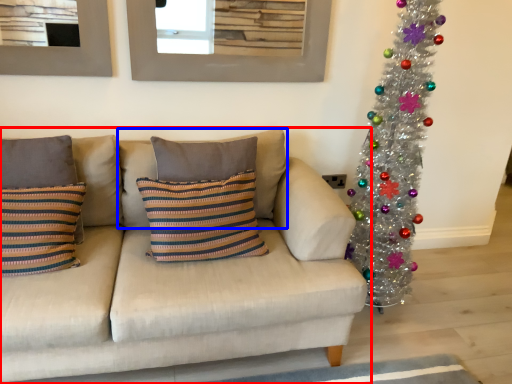
Question: Which object is closer to the camera taking this photo, studio couch (highlighted by a red box) or pillow (highlighted by a blue box)?

Choices:
 (A) studio couch
 (B) pillow

Answer: (A)